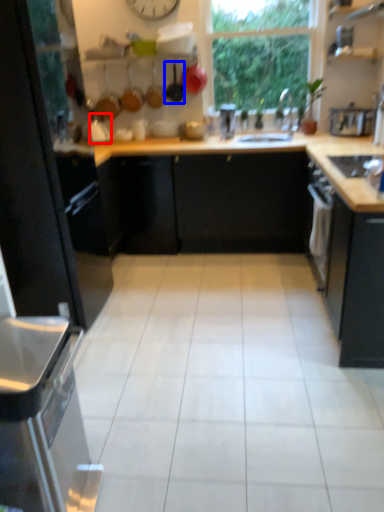
Question: Among these objects, which one is nearest to the camera, appliance (highlighted by a red box) or frying pan (highlighted by a blue box)?

Choices:
 (A) appliance
 (B) frying pan

Answer: (A)